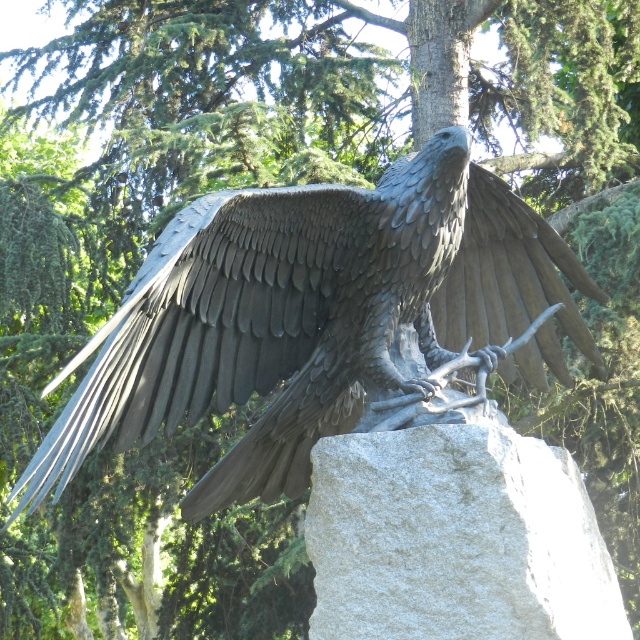
You are an art conservator assessing the placement of the polished bronze eagle at center. Based on its coordinates at point 0.492, 0.483, is it positioned exactly at the center of the image?

The polished bronze eagle at center is located at point (308, 314), which is very close to the exact center coordinates of an image typically being at (320, 320). Therefore, it can be considered positioned exactly at the center.

You are standing in front of the eagle sculpture and want to touch both points on the sculpture. Which point should you reach for first, the point at coordinates point (547, 252) or point (460, 612)?

You should reach for point (547, 252) first because it is closer to you than point (460, 612), which is further away.